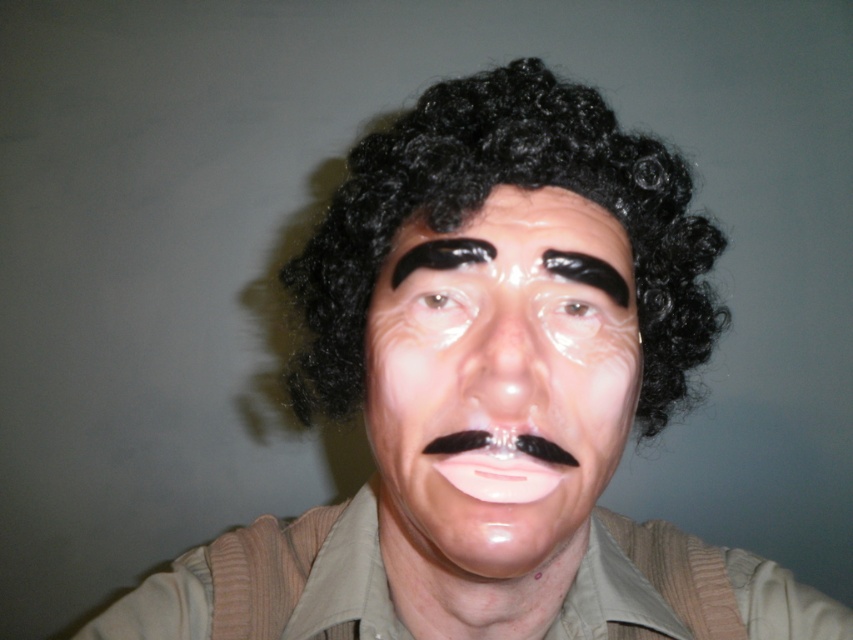
Question: Can you confirm if glossy plastic face at center is positioned below black matte eyebrow at upper center?

Choices:
 (A) yes
 (B) no

Answer: (A)

Question: Which point is closer to the camera taking this photo?

Choices:
 (A) (583, 262)
 (B) (479, 465)
 (C) (553, 317)
 (D) (508, 336)

Answer: (D)

Question: Can you confirm if black matte eyebrow at center is bigger than translucent plastic eye at center?

Choices:
 (A) yes
 (B) no

Answer: (A)

Question: Which of the following is the closest to the observer?

Choices:
 (A) black matte eyebrow at center
 (B) translucent plastic nose at center

Answer: (B)

Question: Does translucent plastic nose at center appear on the left side of black matte eyebrow at upper center?

Choices:
 (A) yes
 (B) no

Answer: (A)

Question: Which point is farther from the camera taking this photo?

Choices:
 (A) (440, 237)
 (B) (576, 260)
 (C) (509, 433)

Answer: (A)